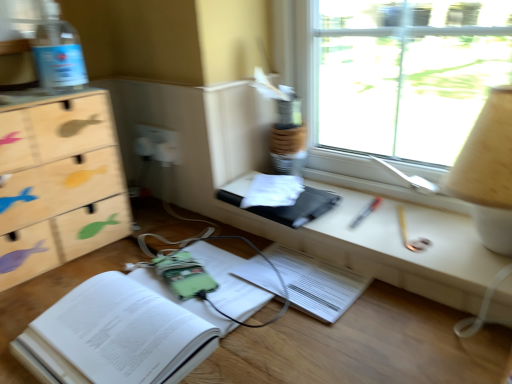
Find the location of a particular element. This screenshot has width=512, height=384. free point above matte black tablet at center (from a real-world perspective) is located at coordinates (386, 212).